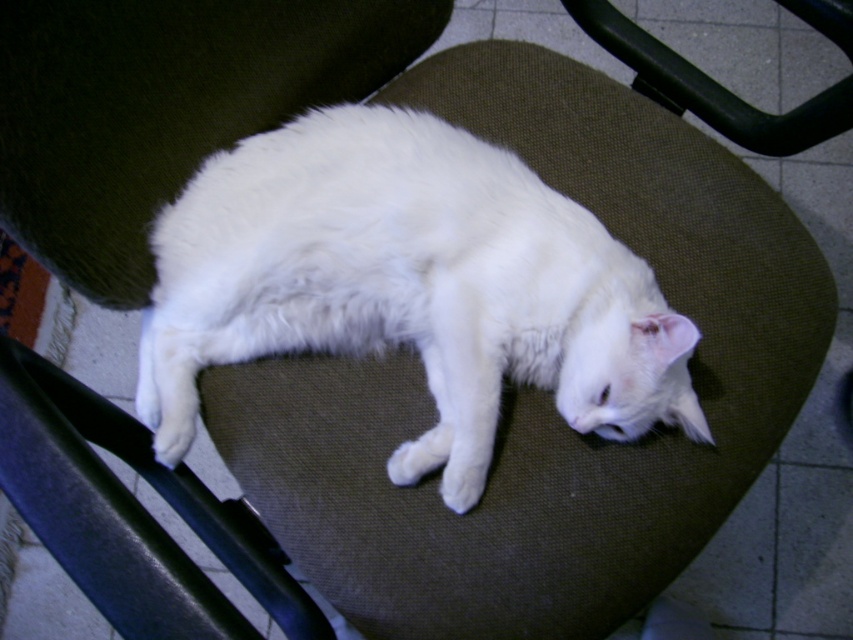
You are a pet sitter who needs to move the white fluffy cat at center to the black plastic swivel chair at upper right. Can you place the cat on the chair without lifting it higher than the chair?

The white fluffy cat at center is located below the black plastic swivel chair at upper right, so you can place the cat on the chair without lifting it higher than the chair.

You are designing a play area for cats and need to place a cat bed and a toy box in the room. The cat bed must be large enough for the white fluffy cat at center to stretch out comfortably. The toy box needs to fit next to the black plastic swivel chair at upper right. Based on the image, which object requires more space horizontally?

The white fluffy cat at center requires more horizontal space because its width is larger than the black plastic swivel chair at upper right.

You are a photographer trying to capture the white fluffy cat at center in the center of your photo. Based on the scene description, is the cat already positioned in the center of the image?

The white fluffy cat at center is located at point (x=408, y=285), which is very close to the center coordinates of (x=426, y=320). Therefore, the cat is already positioned near the center of the image.